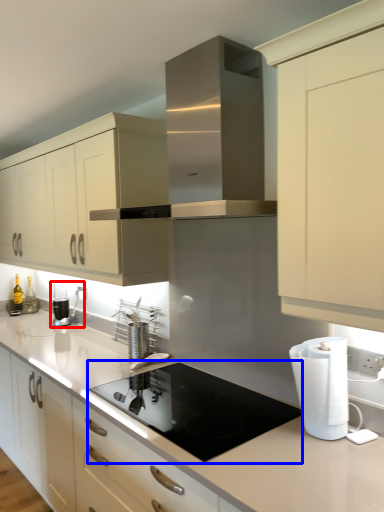
Question: Which of the following is the closest to the observer, coffee machine (highlighted by a red box) or gas stove (highlighted by a blue box)?

Choices:
 (A) coffee machine
 (B) gas stove

Answer: (B)